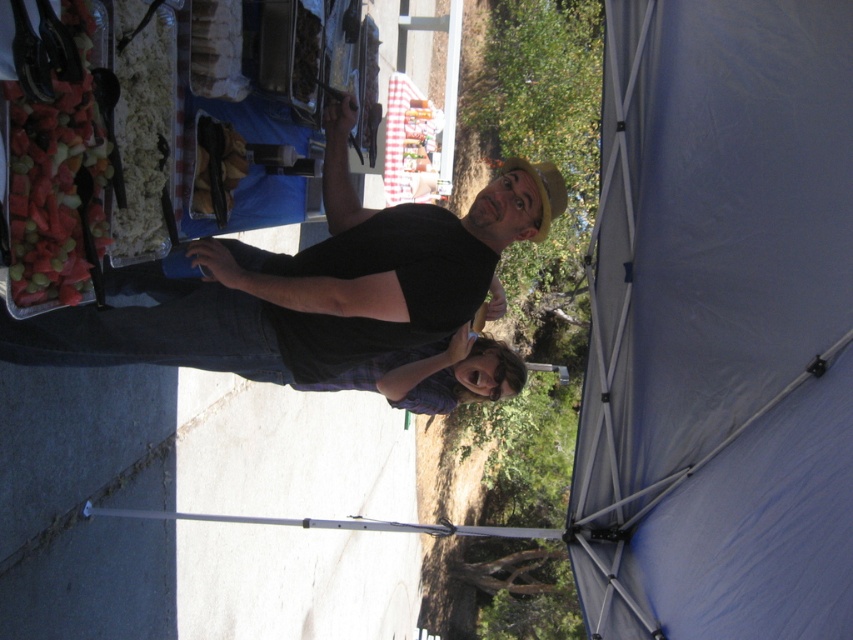
You are standing inside the tent and want to exit through the opening at the back. To do so, you need to walk past the blue fabric tent at upper right and the black matte shirt at center. Which object should you pass first?

The blue fabric tent at upper right is in front of the black matte shirt at center, so you should pass the blue fabric tent at upper right first before reaching the black matte shirt at center.

You are standing inside the tent at the outdoor event. You notice a point marked at coordinates (718, 326) in the image. Based on the scene description, where is this point located?

The point at (718, 326) is located on the blue fabric tent at upper right.

You are setting up a picnic inside the tent and need to place a blanket. Considering the blue fabric tent at upper right and the black matte shirt at center, which object is narrower and would allow more space for the blanket?

The blue fabric tent at upper right has a lesser width compared to the black matte shirt at center, so it is narrower and would allow more space for the blanket.